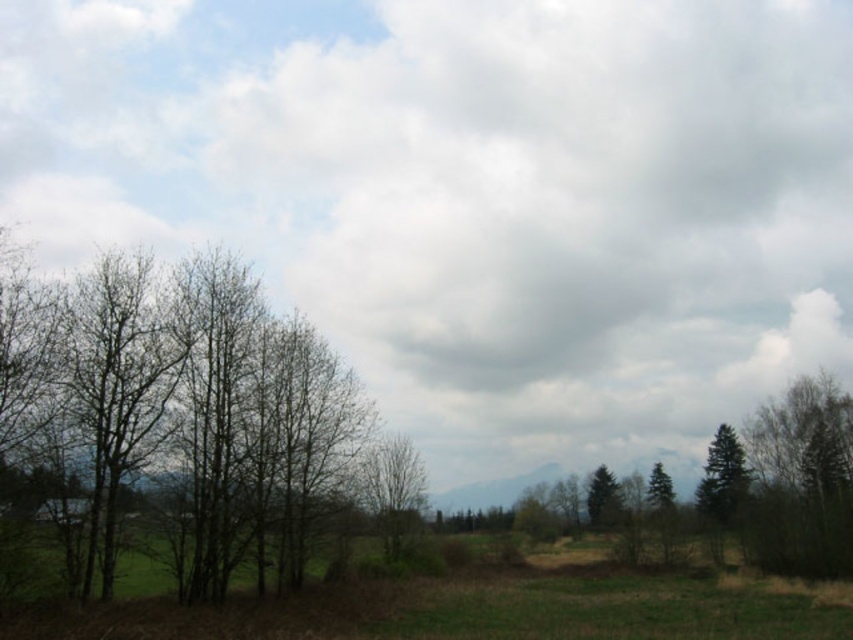
Question: Which point is closer to the camera?

Choices:
 (A) (724, 508)
 (B) (291, 611)

Answer: (B)

Question: Is green grassy field at lower center below smooth bark tree at center?

Choices:
 (A) yes
 (B) no

Answer: (A)

Question: Which point is farther to the camera?

Choices:
 (A) (397, 448)
 (B) (724, 480)
 (C) (682, 570)

Answer: (B)

Question: Is bare branches at left in front of green matte tree at right?

Choices:
 (A) yes
 (B) no

Answer: (A)

Question: Is smooth bark tree at center bigger than green matte tree at right?

Choices:
 (A) no
 (B) yes

Answer: (A)

Question: Which of the following is the closest to the observer?

Choices:
 (A) smooth bark tree at center
 (B) green matte tree at right
 (C) green matte tree at center-right

Answer: (A)